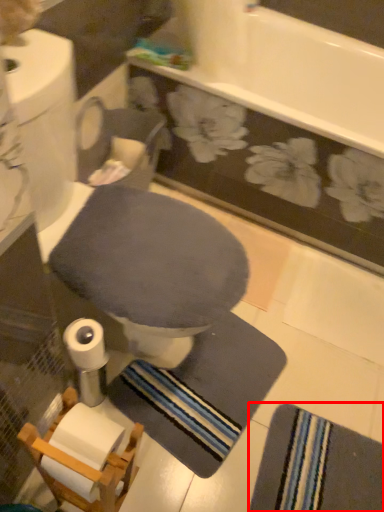
Question: Observing the image, what is the correct spatial positioning of bath towel (annotated by the red box) in reference to toilet bowl?

Choices:
 (A) right
 (B) left

Answer: (A)